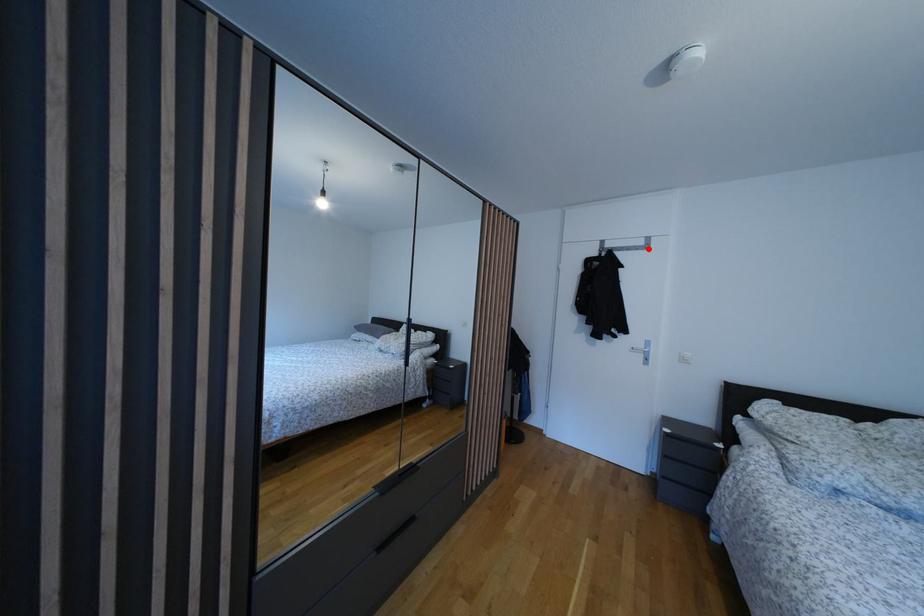
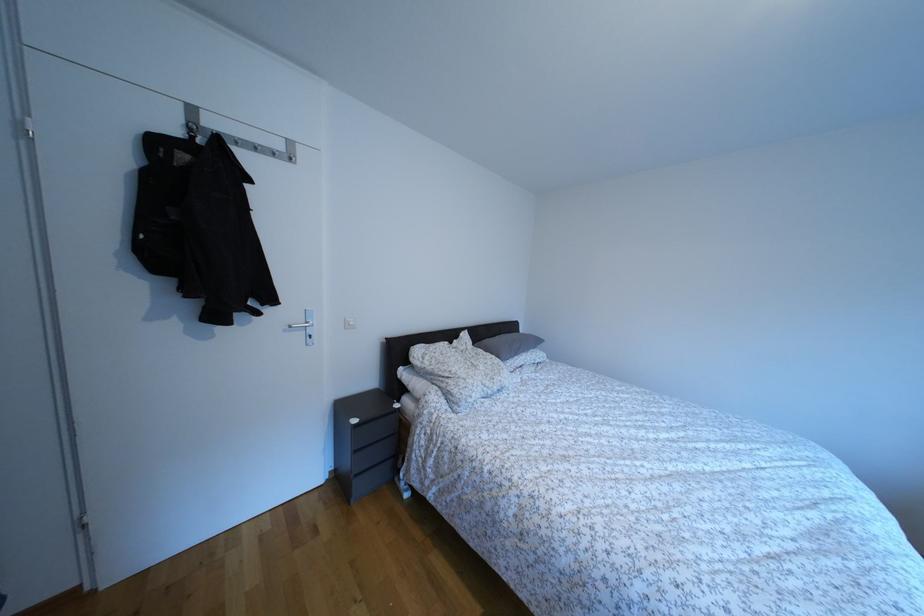
Where in the second image is the point corresponding to the highlighted location from the first image?

(286, 152)